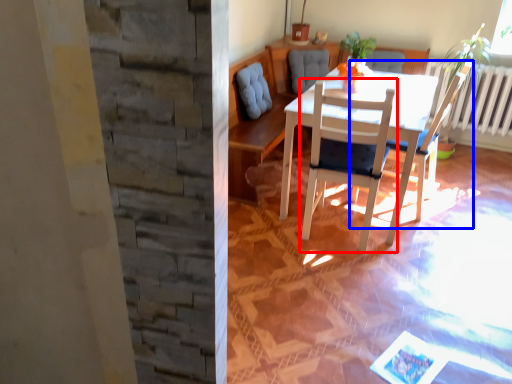
Question: Which object appears closest to the camera in this image, chair (highlighted by a red box) or chair (highlighted by a blue box)?

Choices:
 (A) chair
 (B) chair

Answer: (A)